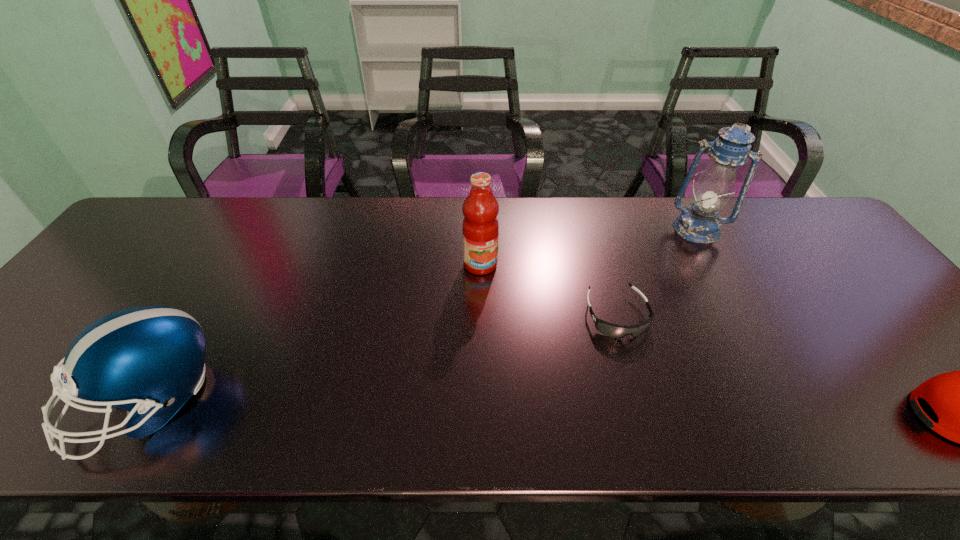
The height and width of the screenshot is (540, 960). What are the coordinates of `free space on the desktop that is between the leftmost object and the rightmost object and is positioned on the front label of the fruit juice` in the screenshot? It's located at (582, 409).

Where is `free spot on the desktop that is between the leftmost object and the rightmost object and is positioned on the front and sides of the shortest object`? This screenshot has width=960, height=540. free spot on the desktop that is between the leftmost object and the rightmost object and is positioned on the front and sides of the shortest object is located at coordinates (657, 410).

This screenshot has height=540, width=960. Find the location of `free spot on the desktop that is between the third shortest object and the fourth tallest object and is positioned on the front-facing side of the tallest object`. free spot on the desktop that is between the third shortest object and the fourth tallest object and is positioned on the front-facing side of the tallest object is located at coordinates (627, 409).